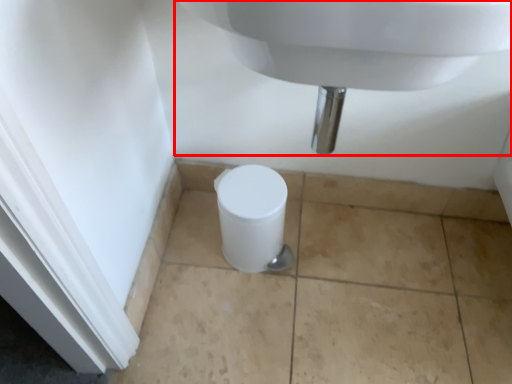
Question: From the image's perspective, where is sink (annotated by the red box) located in relation to toilet in the image?

Choices:
 (A) above
 (B) below

Answer: (A)